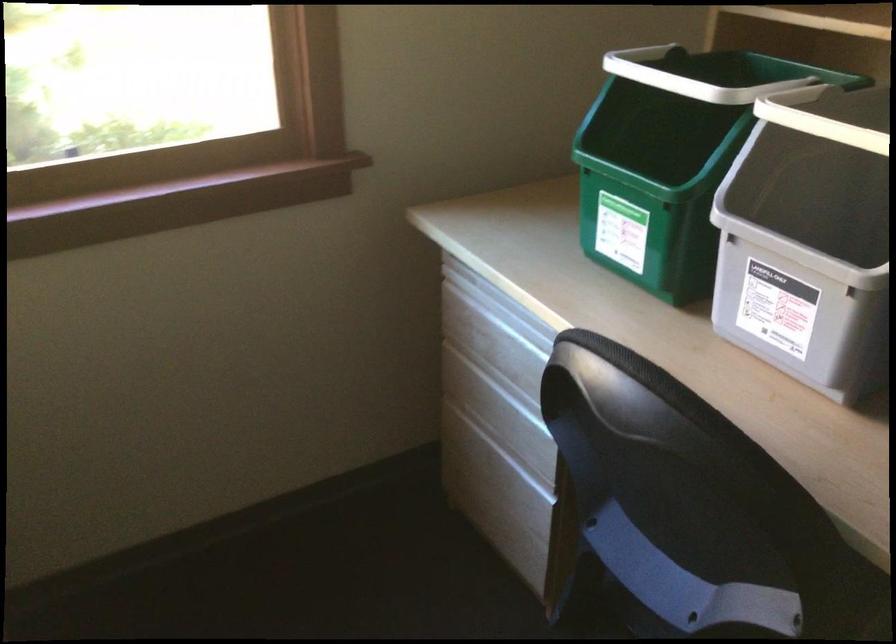
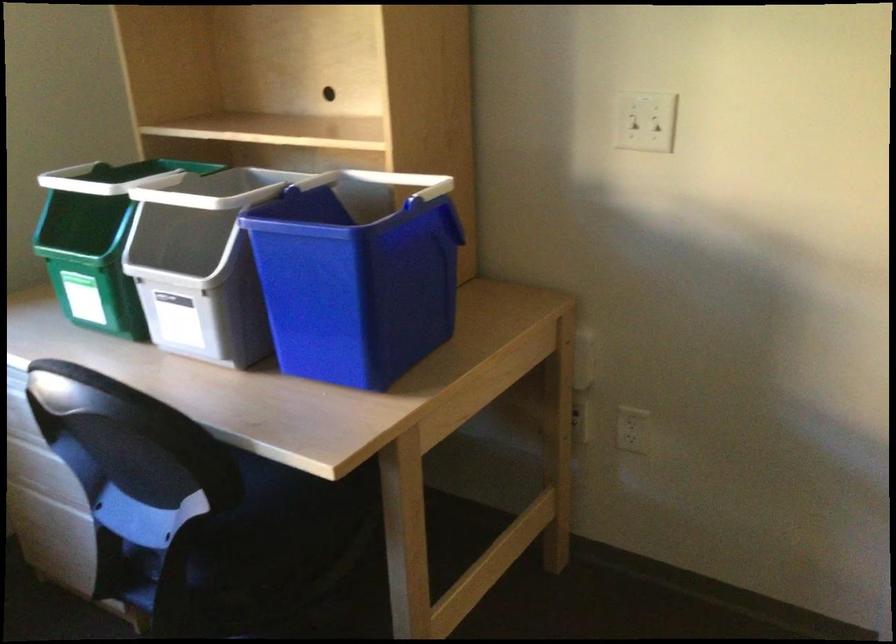
Locate, in the second image, the point that corresponds to point (656, 556) in the first image.

(151, 518)